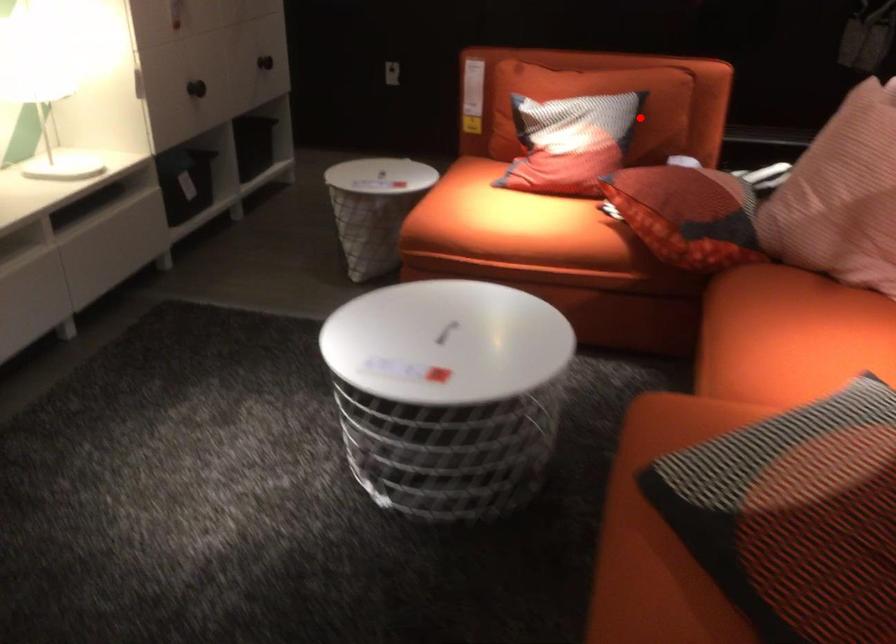
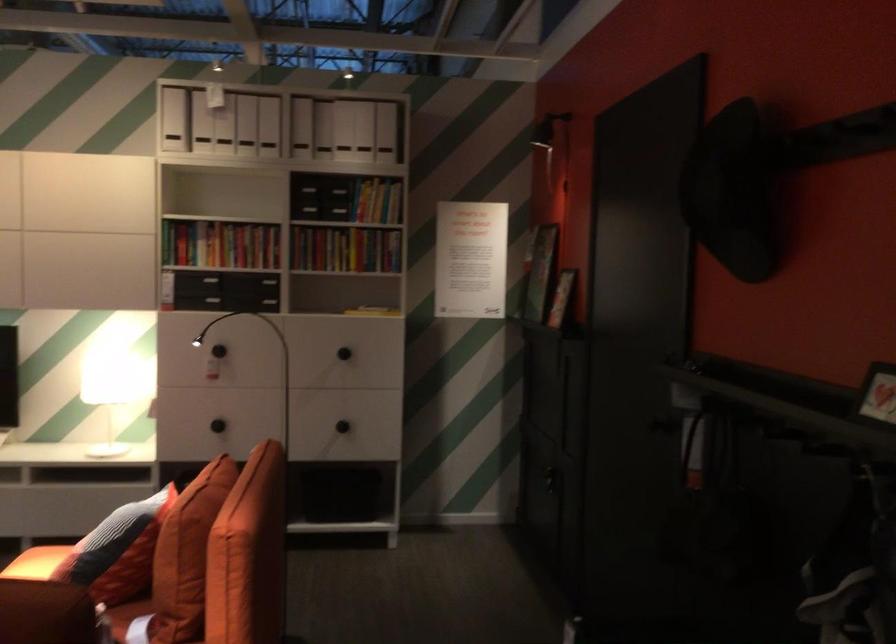
Where in the second image is the point corresponding to the highlighted location from the first image?

(117, 551)